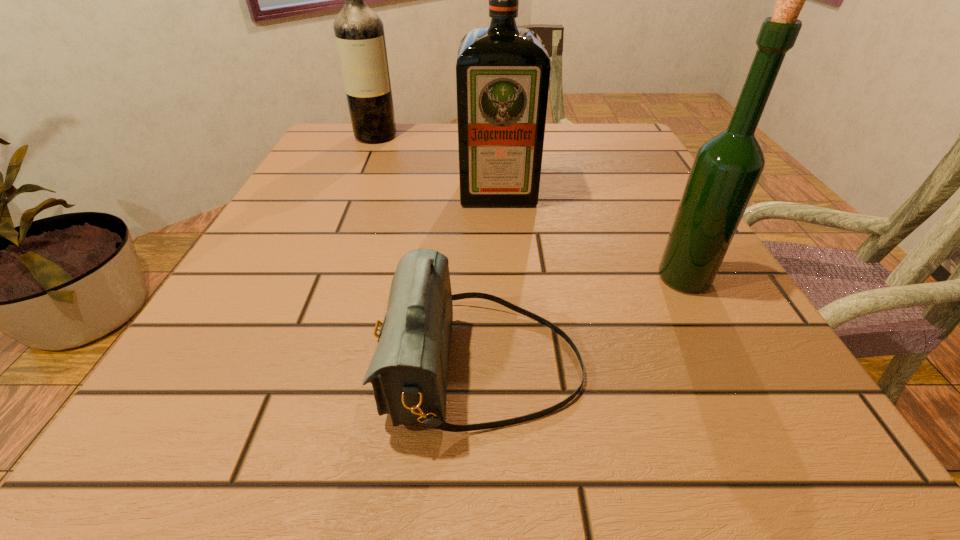
Locate an element on the screen. The width and height of the screenshot is (960, 540). object that is the third nearest to the shortest object is located at coordinates (359, 32).

Locate which liquor is the second closest to the shoulder bag. Please provide its 2D coordinates. Your answer should be formatted as a tuple, i.e. [(x, y)], where the tuple contains the x and y coordinates of a point satisfying the conditions above.

[(503, 72)]

You are a GUI agent. You are given a task and a screenshot of the screen. Output one action in this format:
    pyautogui.click(x=<x>, y=<y>)
    Task: Click on the liquor that is the closest one to the farthest object
    This screenshot has width=960, height=540.
    Given the screenshot: What is the action you would take?
    pyautogui.click(x=503, y=72)

At what (x,y) coordinates should I click in order to perform the action: click on free location that satisfies the following two spatial constraints: 1. on the front-facing side of the leftmost object; 2. on the right side of the shortest object. Please return your answer as a coordinate pair (x, y). Looking at the image, I should click on (277, 366).

Find the location of `vacant point that satisfies the following two spatial constraints: 1. on the front label of the third nearest object; 2. on the right side of the nearest liquor`. vacant point that satisfies the following two spatial constraints: 1. on the front label of the third nearest object; 2. on the right side of the nearest liquor is located at coordinates (503, 278).

The height and width of the screenshot is (540, 960). I want to click on free point that satisfies the following two spatial constraints: 1. on the back side of the nearest liquor; 2. on the right side of the nearest object, so click(x=482, y=278).

At what (x,y) coordinates should I click in order to perform the action: click on vacant region that satisfies the following two spatial constraints: 1. on the back side of the shortest object; 2. on the right side of the third farthest object. Please return your answer as a coordinate pair (x, y). The image size is (960, 540). Looking at the image, I should click on (482, 278).

Where is `vacant area in the image that satisfies the following two spatial constraints: 1. on the front label of the rightmost liquor; 2. on the right side of the second farthest liquor`? The height and width of the screenshot is (540, 960). vacant area in the image that satisfies the following two spatial constraints: 1. on the front label of the rightmost liquor; 2. on the right side of the second farthest liquor is located at coordinates (503, 278).